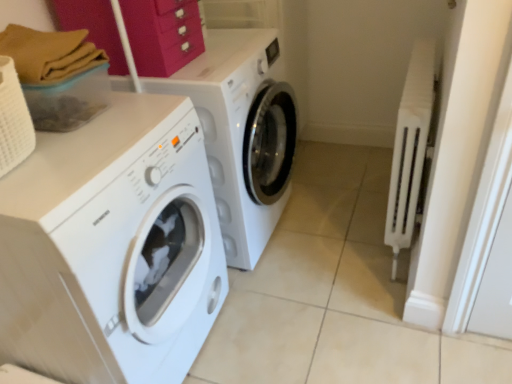
What are the coordinates of `free point above white glossy washing machine at left, which is counted as the 1th washing machine, starting from the front (from a real-world perspective)` in the screenshot? It's located at (93, 131).